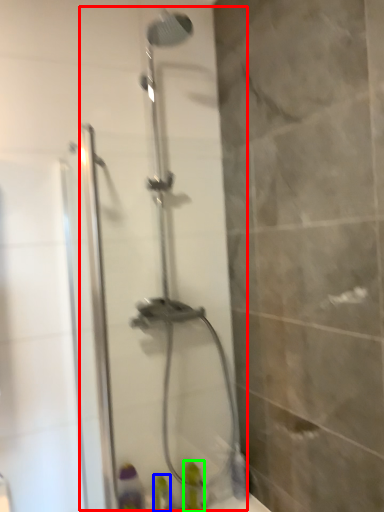
Question: Which object is positioned closest to shower door (highlighted by a red box)? Select from toiletry (highlighted by a blue box) and toiletry (highlighted by a green box).

Choices:
 (A) toiletry
 (B) toiletry

Answer: (B)